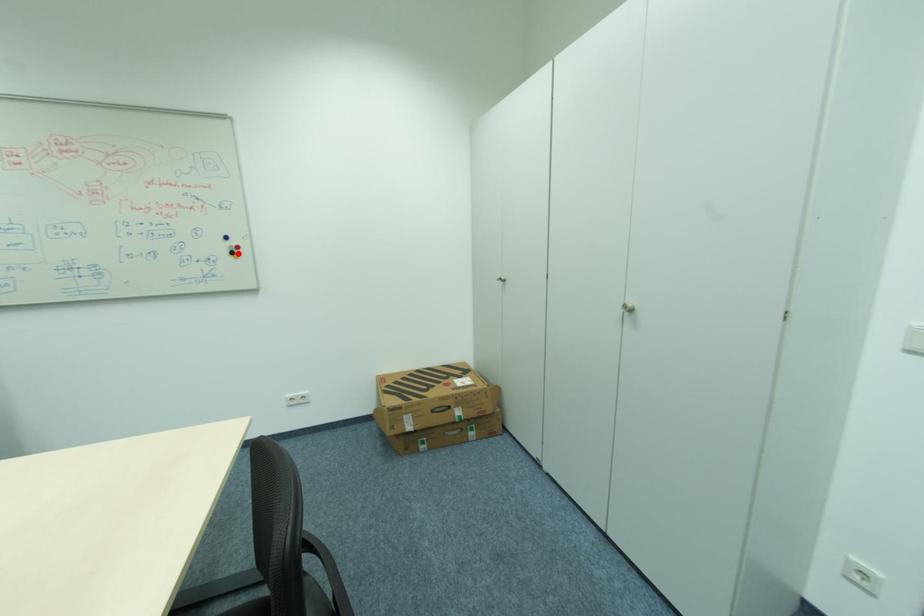
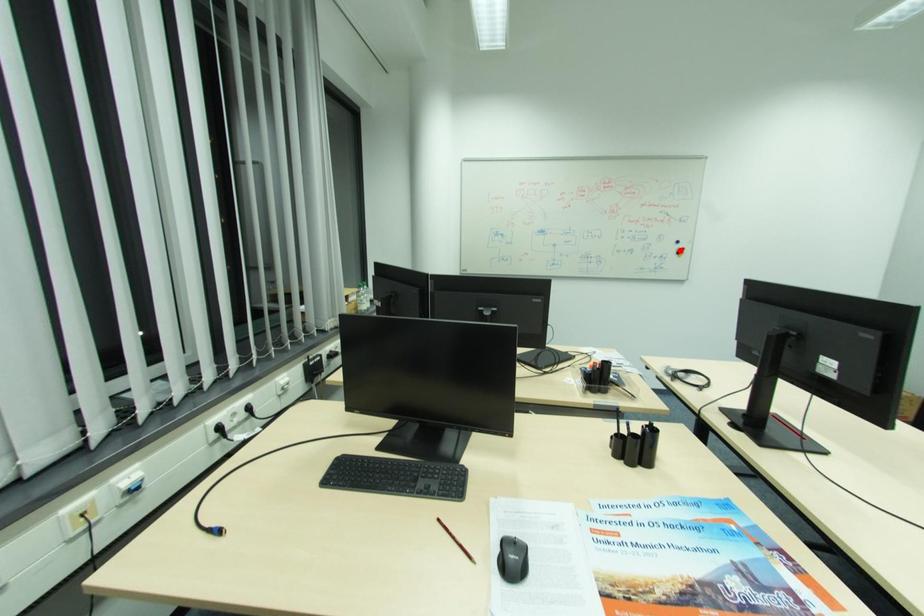
I am providing you with two images of the same scene from different viewpoints. A red point is marked on the first image and another point is marked on the second image. Do the highlighted points in image1 and image2 indicate the same real-world spot?

No